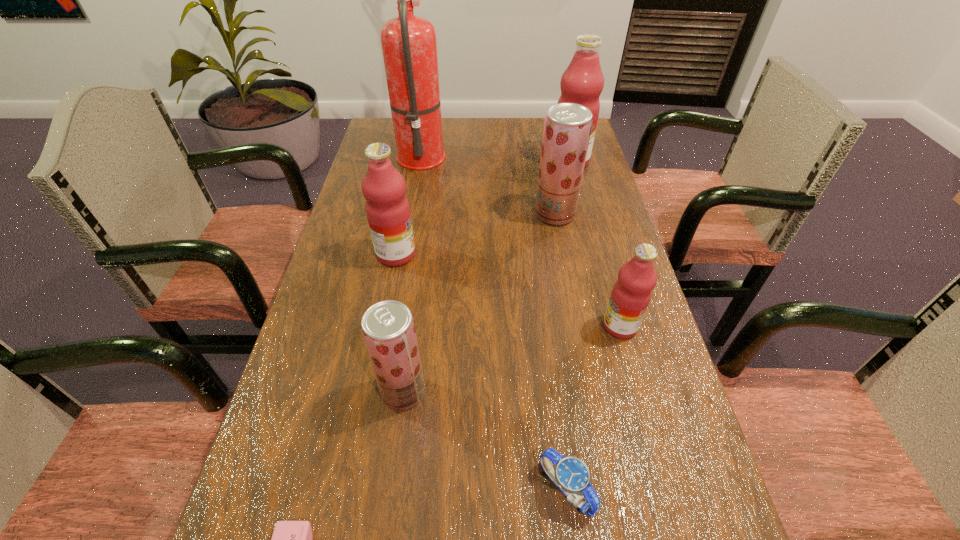
At what (x,y) coordinates should I click in order to perform the action: click on fruit juice that is the fourth closest to the second nearest object. Please return your answer as a coordinate pair (x, y). The width and height of the screenshot is (960, 540). Looking at the image, I should click on (567, 127).

Locate an element on the screen. The height and width of the screenshot is (540, 960). pink fruit juice that is the second nearest to the fire extinguisher is located at coordinates click(x=582, y=82).

Find the location of `pink fruit juice that is the closest to the red fire extinguisher`. pink fruit juice that is the closest to the red fire extinguisher is located at coordinates (388, 212).

Where is `vacant region that satisfies the following two spatial constraints: 1. on the label of the second biggest pink fruit juice; 2. on the left side of the third nearest object`? The image size is (960, 540). vacant region that satisfies the following two spatial constraints: 1. on the label of the second biggest pink fruit juice; 2. on the left side of the third nearest object is located at coordinates (370, 392).

You are a GUI agent. You are given a task and a screenshot of the screen. Output one action in this format:
    pyautogui.click(x=<x>, y=<y>)
    Task: Click on the free space that satisfies the following two spatial constraints: 1. with the handle and hose on the right strawberry fruit juice; 2. on the left side of the fire extinguisher
    
    Given the screenshot: What is the action you would take?
    pyautogui.click(x=411, y=214)

Locate an element on the screen. The image size is (960, 540). free spot that satisfies the following two spatial constraints: 1. on the label of the farthest pink fruit juice; 2. on the label of the second biggest pink fruit juice is located at coordinates (593, 254).

This screenshot has height=540, width=960. I want to click on free location that satisfies the following two spatial constraints: 1. on the back side of the smaller strawberry fruit juice; 2. on the label of the third farthest fruit juice, so click(x=421, y=254).

Identify the location of vacant region that satisfies the following two spatial constraints: 1. with the handle and hose on the nearest fruit juice; 2. on the right side of the tallest object. [x=380, y=392].